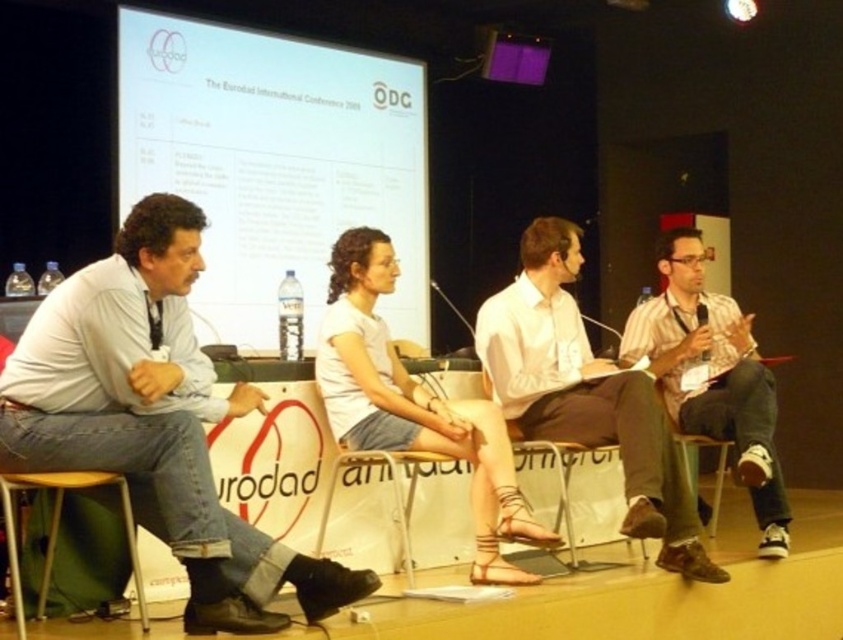
Does light blue shirt at left have a smaller size compared to white plastic chair at center?

No.

At what (x,y) coordinates should I click in order to perform the action: click on light blue shirt at left. Please return your answer as a coordinate pair (x, y). The width and height of the screenshot is (843, 640). Looking at the image, I should click on tap(154, 420).

You are a GUI agent. You are given a task and a screenshot of the screen. Output one action in this format:
    pyautogui.click(x=<x>, y=<y>)
    Task: Click on the light blue shirt at left
    This screenshot has width=843, height=640.
    Given the screenshot: What is the action you would take?
    pyautogui.click(x=154, y=420)

Is white glossy projection screen at upper center positioned before wooden at right?

No, it is behind wooden at right.

Between point (181, 148) and point (723, 458), which one is positioned behind?

Point (181, 148)

Which is in front, point (207, 150) or point (721, 448)?

Point (721, 448)

The image size is (843, 640). I want to click on white glossy projection screen at upper center, so click(274, 164).

Can you confirm if striped cotton shirt at center is positioned below white plastic chair at center?

Actually, striped cotton shirt at center is above white plastic chair at center.

Can you confirm if striped cotton shirt at center is positioned to the right of white plastic chair at center?

Yes, striped cotton shirt at center is to the right of white plastic chair at center.

Which is in front, point (763, 365) or point (336, 483)?

Point (336, 483) is more forward.

You are a GUI agent. You are given a task and a screenshot of the screen. Output one action in this format:
    pyautogui.click(x=<x>, y=<y>)
    Task: Click on the striped cotton shirt at center
    
    Given the screenshot: What is the action you would take?
    pyautogui.click(x=712, y=376)